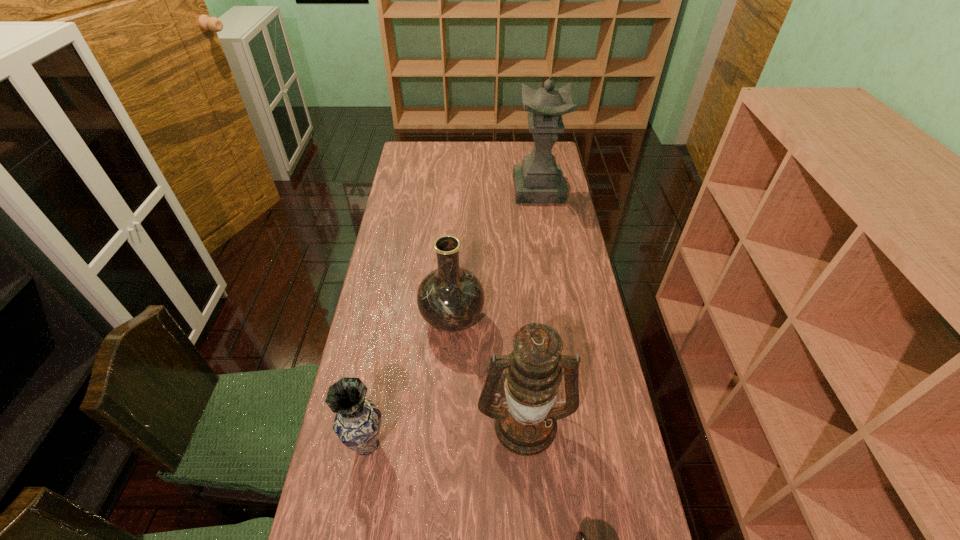
I want to click on vacant region located 0.260m on the back of the fourth tallest object, so click(385, 345).

Locate an element on the screen. object that is at the left edge is located at coordinates (357, 423).

Where is `sculpture that is at the right edge`? sculpture that is at the right edge is located at coordinates (538, 179).

Locate an element on the screen. Image resolution: width=960 pixels, height=540 pixels. lantern that is at the right edge is located at coordinates (525, 423).

At what (x,y) coordinates should I click in order to perform the action: click on vacant space at the far edge of the desktop. Please return your answer as a coordinate pair (x, y). The height and width of the screenshot is (540, 960). Looking at the image, I should click on (492, 141).

Where is `vacant space at the left edge of the desktop`? The height and width of the screenshot is (540, 960). vacant space at the left edge of the desktop is located at coordinates (405, 288).

Find the location of `vacant space at the right edge of the desktop`. vacant space at the right edge of the desktop is located at coordinates pyautogui.click(x=539, y=214).

The image size is (960, 540). In the image, there is a desktop. Find the location of `vacant space at the far left corner`. vacant space at the far left corner is located at coordinates (410, 153).

The image size is (960, 540). What are the coordinates of `free area in between the tallest object and the right vase` in the screenshot? It's located at (495, 254).

Identify the location of vacant area between the sculpture and the lantern. This screenshot has width=960, height=540. (532, 306).